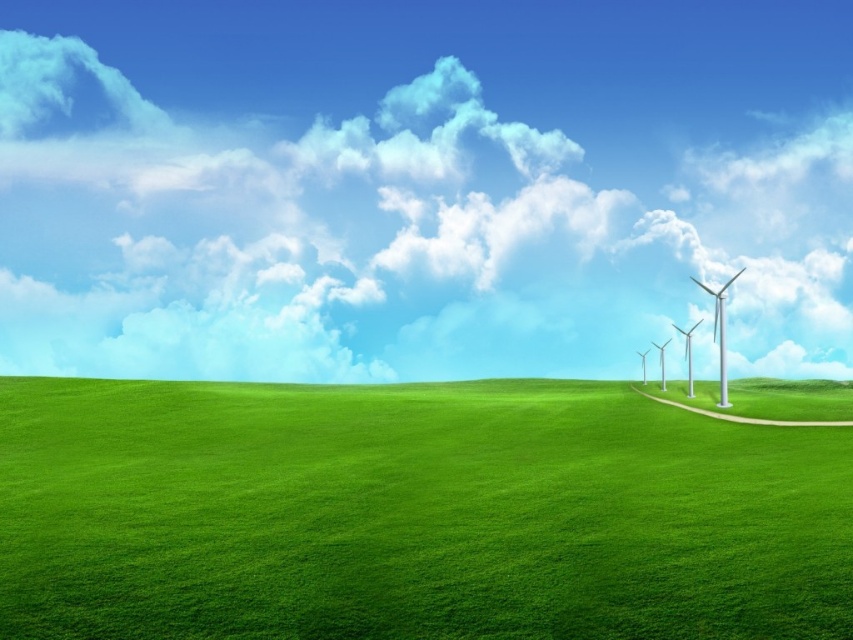
You are a photographer planning to capture a photo of the green grassy field at center and the metallic silver wind turbine at right. If you want to ensure both subjects are clearly visible in the frame, which object should you focus on first to maintain sharpness?

The metallic silver wind turbine at right is taller than the green grassy field at center, so focusing on the turbine first would help maintain sharpness for both subjects as it is the taller object.